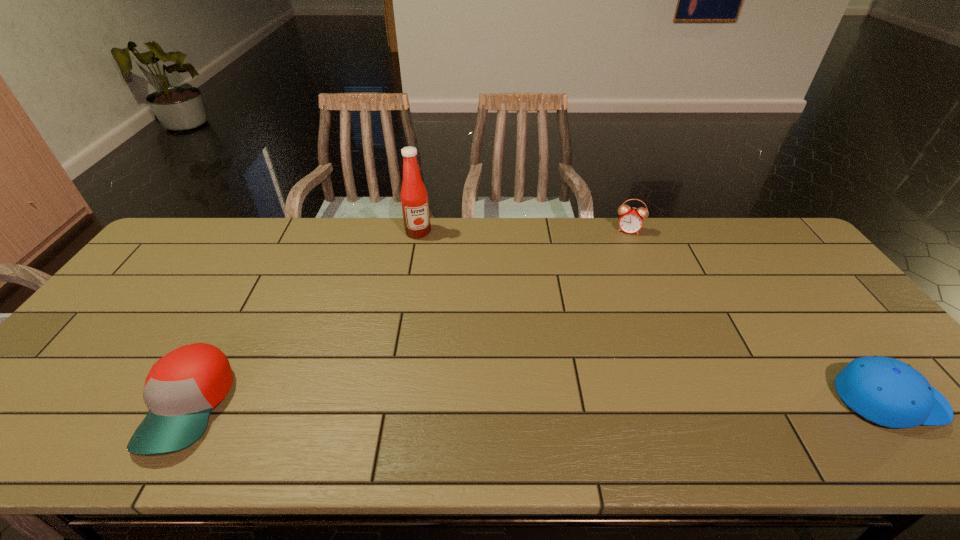
The image size is (960, 540). I want to click on free space on the desktop that is between the baseball cap and the rightmost object and is positioned on the front-facing side of the condiment, so click(x=475, y=403).

Find the location of a particular element. vacant space on the desktop that is between the leftmost object and the cap and is positioned on the clock face of the alarm clock is located at coordinates (601, 402).